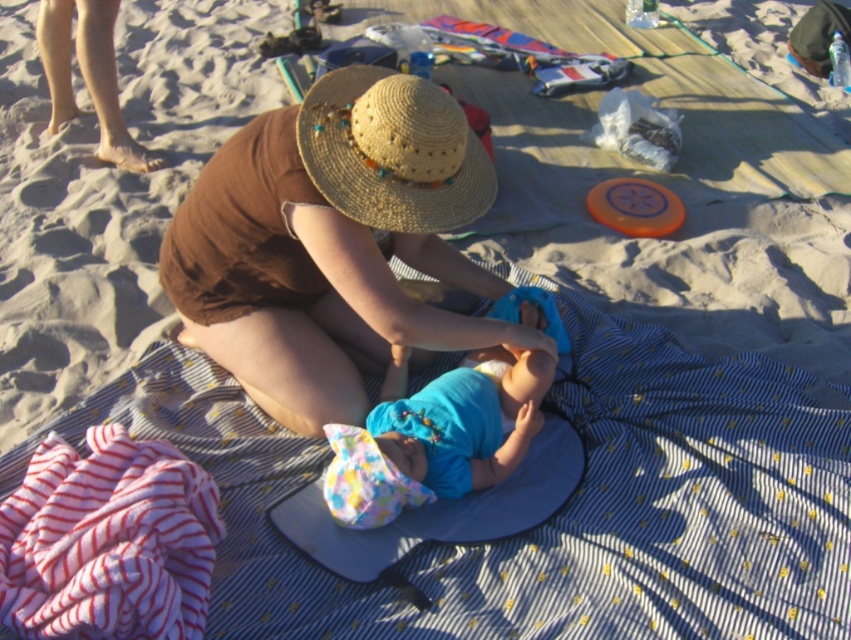
Does brown straw hat at center have a larger size compared to straw hat at center?

Correct, brown straw hat at center is larger in size than straw hat at center.

I want to click on brown straw hat at center, so click(x=332, y=243).

Can you confirm if striped cotton towel at lower left is wider than blue fabric baby at center?

No.

Is striped cotton towel at lower left thinner than blue fabric baby at center?

Yes, striped cotton towel at lower left is thinner than blue fabric baby at center.

Between point (106, 579) and point (413, 468), which one is positioned behind?

The point (413, 468) is behind.

I want to click on striped cotton towel at lower left, so click(x=107, y=541).

Consider the image. Is brown straw hat at center to the right of blue fabric baby at center from the viewer's perspective?

No, brown straw hat at center is not to the right of blue fabric baby at center.

Can you confirm if brown straw hat at center is smaller than blue fabric baby at center?

Actually, brown straw hat at center might be larger than blue fabric baby at center.

In order to click on brown straw hat at center in this screenshot , I will do `click(332, 243)`.